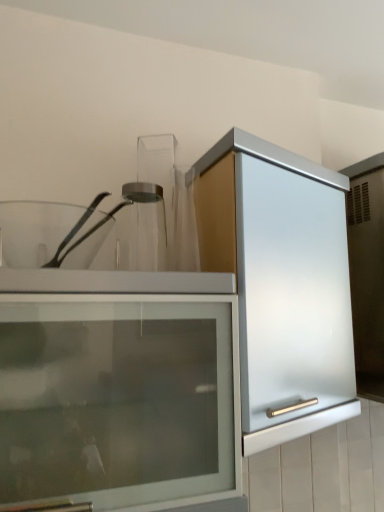
This screenshot has height=512, width=384. In order to click on clear glass jar at center in this screenshot , I will do `click(143, 227)`.

What do you see at coordinates (143, 227) in the screenshot? I see `clear glass jar at center` at bounding box center [143, 227].

Image resolution: width=384 pixels, height=512 pixels. Describe the element at coordinates (281, 283) in the screenshot. I see `satin silver cabinet at center` at that location.

Find the location of a particular element. satin silver cabinet at center is located at coordinates (281, 283).

Locate an element on the screen. The width and height of the screenshot is (384, 512). clear glass jar at center is located at coordinates (143, 227).

Would you say clear glass jar at center is to the left or to the right of satin silver cabinet at center in the picture?

clear glass jar at center is to the left of satin silver cabinet at center.

Is clear glass jar at center closer to the viewer compared to satin silver cabinet at center?

No, clear glass jar at center is behind satin silver cabinet at center.

Does point (147, 217) appear closer or farther from the camera than point (247, 310)?

Point (147, 217).

From the image's perspective, is clear glass jar at center positioned above or below satin silver cabinet at center?

Clearly, from the image's perspective, clear glass jar at center is above satin silver cabinet at center.

From a real-world perspective, is clear glass jar at center located beneath satin silver cabinet at center?

No, from a real-world perspective, clear glass jar at center is not beneath satin silver cabinet at center.

Does clear glass jar at center have a lesser width compared to satin silver cabinet at center?

Yes, clear glass jar at center is thinner than satin silver cabinet at center.

Does clear glass jar at center have a greater height compared to satin silver cabinet at center?

No, clear glass jar at center is not taller than satin silver cabinet at center.

Who is smaller, clear glass jar at center or satin silver cabinet at center?

clear glass jar at center.

Is clear glass jar at center inside the boundaries of satin silver cabinet at center, or outside?

clear glass jar at center is located beyond the bounds of satin silver cabinet at center.

Are clear glass jar at center and satin silver cabinet at center located far from each other?

No.

Could you tell me if clear glass jar at center is facing satin silver cabinet at center?

No, clear glass jar at center is not facing towards satin silver cabinet at center.

How different are the orientations of clear glass jar at center and satin silver cabinet at center in degrees?

The angle between the facing direction of clear glass jar at center and the facing direction of satin silver cabinet at center is 1.46 degrees.

The image size is (384, 512). I want to click on glass jar behind the satin silver cabinet at center, so pyautogui.click(x=143, y=227).

Is satin silver cabinet at center at the left side of clear glass jar at center?

Incorrect, satin silver cabinet at center is not on the left side of clear glass jar at center.

In the image, is satin silver cabinet at center positioned in front of or behind clear glass jar at center?

In the image, satin silver cabinet at center appears in front of clear glass jar at center.

Is point (297, 351) positioned behind point (139, 199)?

No, it is in front of (139, 199).

From the picture: From the image's perspective, is satin silver cabinet at center located above clear glass jar at center?

No.

From a real-world perspective, is satin silver cabinet at center under clear glass jar at center?

Yes.

Considering the sizes of objects satin silver cabinet at center and clear glass jar at center in the image provided, who is thinner, satin silver cabinet at center or clear glass jar at center?

clear glass jar at center is thinner.

Which of these two, satin silver cabinet at center or clear glass jar at center, stands taller?

satin silver cabinet at center is taller.

Based on the photo, in terms of size, does satin silver cabinet at center appear bigger or smaller than clear glass jar at center?

In the image, satin silver cabinet at center appears to be larger than clear glass jar at center.

Is satin silver cabinet at center positioned beyond the bounds of clear glass jar at center?

Absolutely, satin silver cabinet at center is external to clear glass jar at center.

In the scene shown: Is satin silver cabinet at center far from clear glass jar at center?

They are positioned close to each other.

Could you tell me if satin silver cabinet at center is facing clear glass jar at center?

No, satin silver cabinet at center is not oriented towards clear glass jar at center.

Locate an element on the screen. glass jar lying on the left of satin silver cabinet at center is located at coordinates (143, 227).

I want to click on cabinetry on the right side of clear glass jar at center, so click(281, 283).

Identify the location of glass jar above the satin silver cabinet at center (from the image's perspective). The width and height of the screenshot is (384, 512). (143, 227).